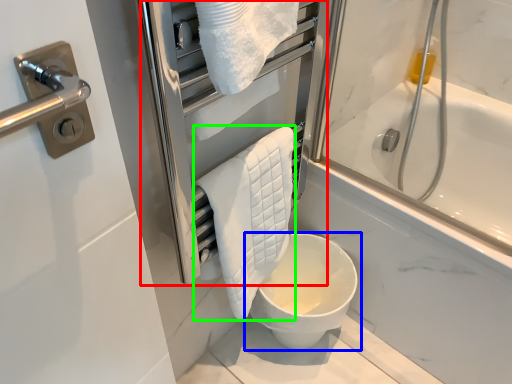
Question: Considering the real-world distances, which object is closest to screen door (highlighted by a red box)? toilet (highlighted by a blue box) or bath towel (highlighted by a green box).

Choices:
 (A) toilet
 (B) bath towel

Answer: (B)